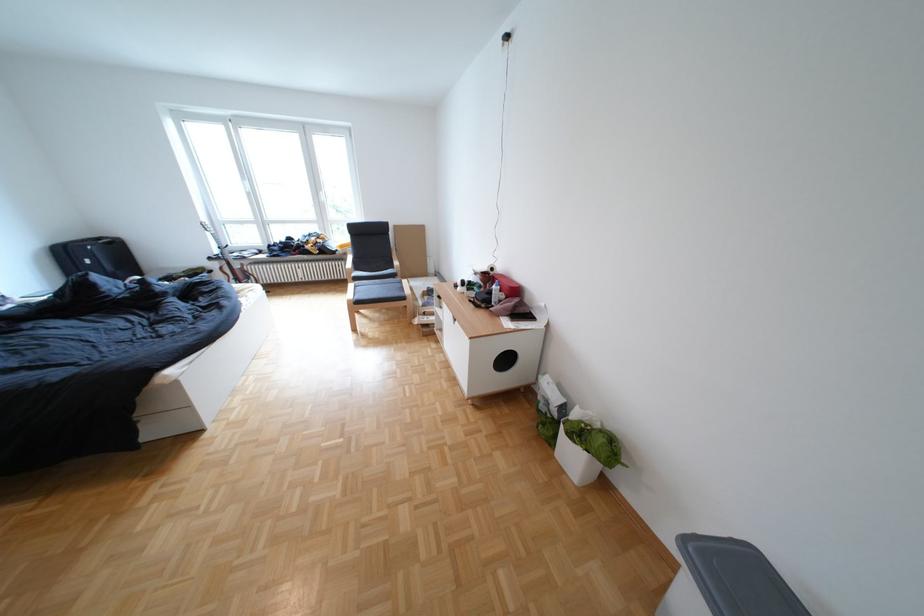
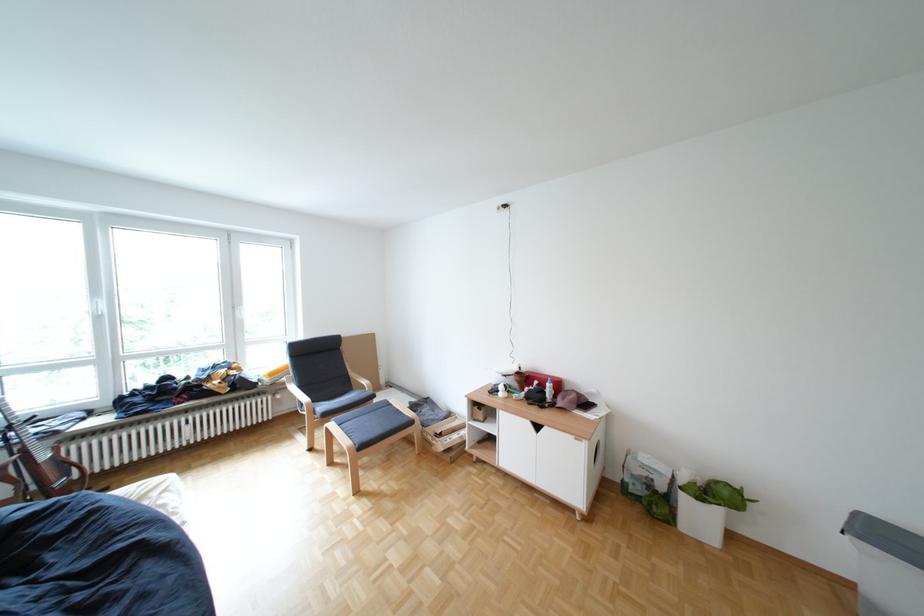
Find the pixel in the second image that matches point 358,246 in the first image.

(286, 374)